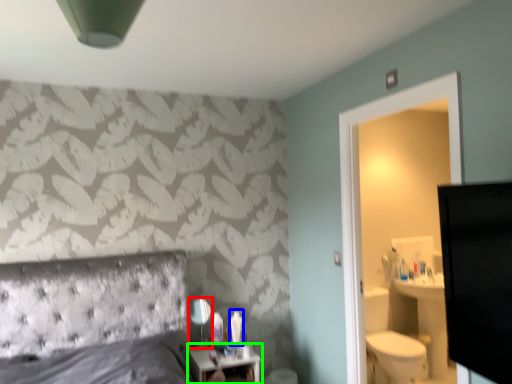
Question: Based on their relative distances, which object is nearer to mirror (highlighted by a red box)? Choose from toiletry (highlighted by a blue box) and nightstand (highlighted by a green box).

Choices:
 (A) toiletry
 (B) nightstand

Answer: (B)